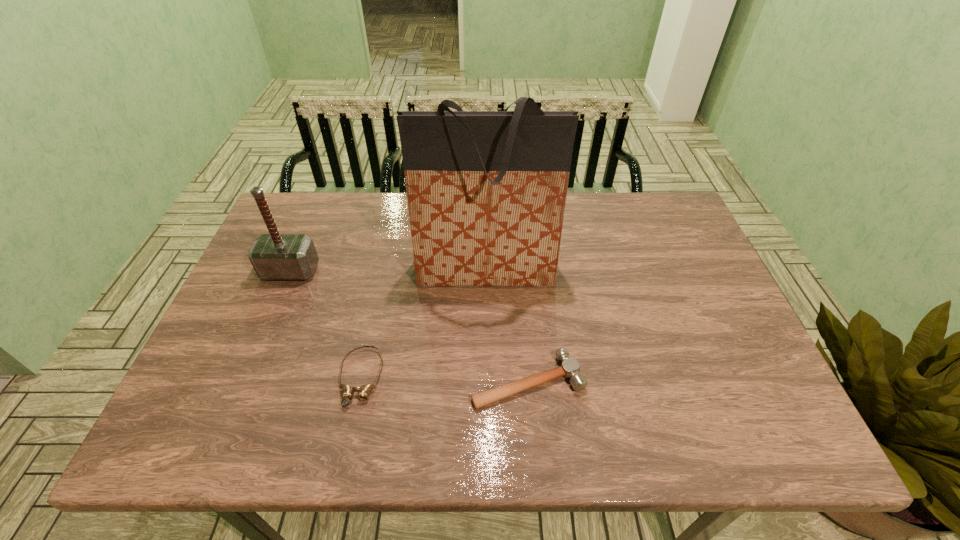
Locate an element on the screen. This screenshot has width=960, height=540. object at the near edge is located at coordinates (570, 367).

Where is `object that is at the left edge`? This screenshot has height=540, width=960. object that is at the left edge is located at coordinates (274, 256).

In the image, there is a desktop. Identify the location of vacant space at the far edge. (401, 237).

This screenshot has height=540, width=960. What are the coordinates of `vacant space at the near edge of the desktop` in the screenshot? It's located at pyautogui.click(x=318, y=450).

In the image, there is a desktop. Where is `vacant region at the left edge`? The image size is (960, 540). vacant region at the left edge is located at coordinates (215, 363).

At what (x,y) coordinates should I click in order to perform the action: click on free space at the right edge of the desktop. Please return your answer as a coordinate pair (x, y). Image resolution: width=960 pixels, height=540 pixels. Looking at the image, I should click on (744, 391).

I want to click on free region at the near left corner of the desktop, so click(x=218, y=448).

The width and height of the screenshot is (960, 540). In the image, there is a desktop. What are the coordinates of `vacant space at the far right corner` in the screenshot? It's located at click(x=665, y=234).

This screenshot has width=960, height=540. What are the coordinates of `unoccupied area between the tallest object and the second object from left to right` in the screenshot? It's located at (423, 324).

Locate an element on the screen. empty space between the nearer hammer and the goggles is located at coordinates (444, 379).